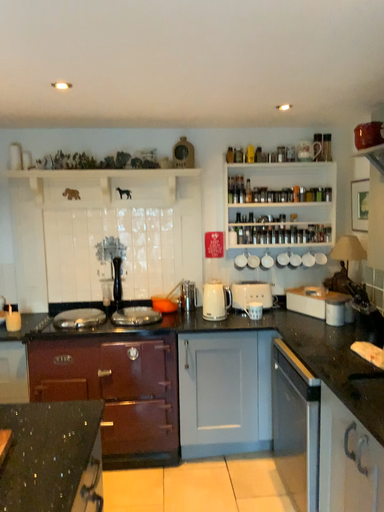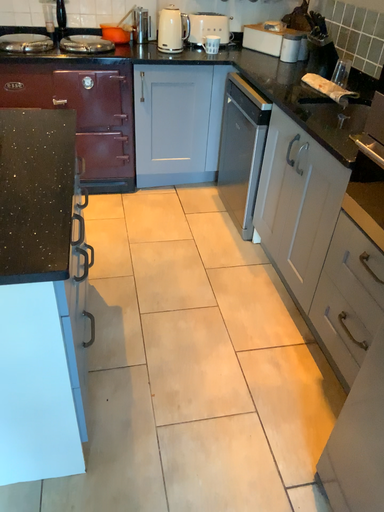
Question: Which way did the camera rotate in the video?

Choices:
 (A) rotated left
 (B) rotated right

Answer: (B)